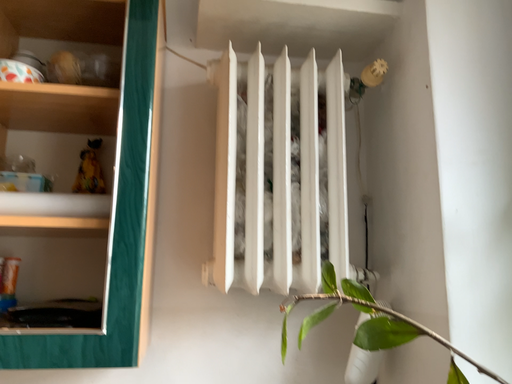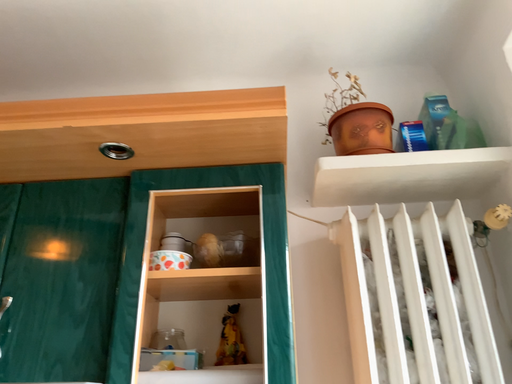
Question: How did the camera likely rotate when shooting the video?

Choices:
 (A) rotated left
 (B) rotated right

Answer: (A)